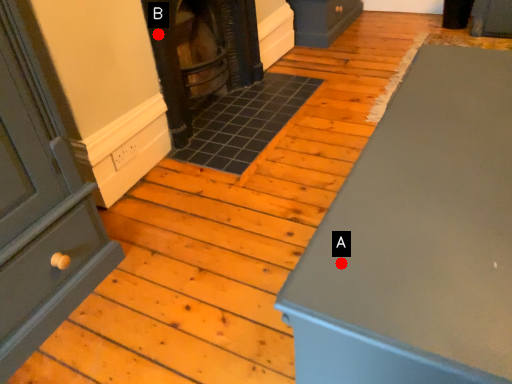
Question: Two points are circled on the image, labeled by A and B beside each circle. Which point appears closest to the camera in this image?

Choices:
 (A) A is closer
 (B) B is closer

Answer: (A)